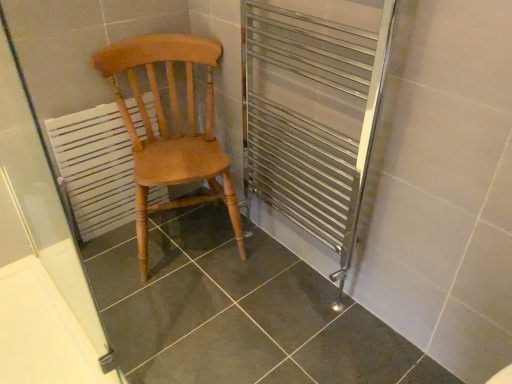
Locate an element on the screen. This screenshot has width=512, height=384. vacant area that is situated to the right of white matte screen door at left is located at coordinates (182, 326).